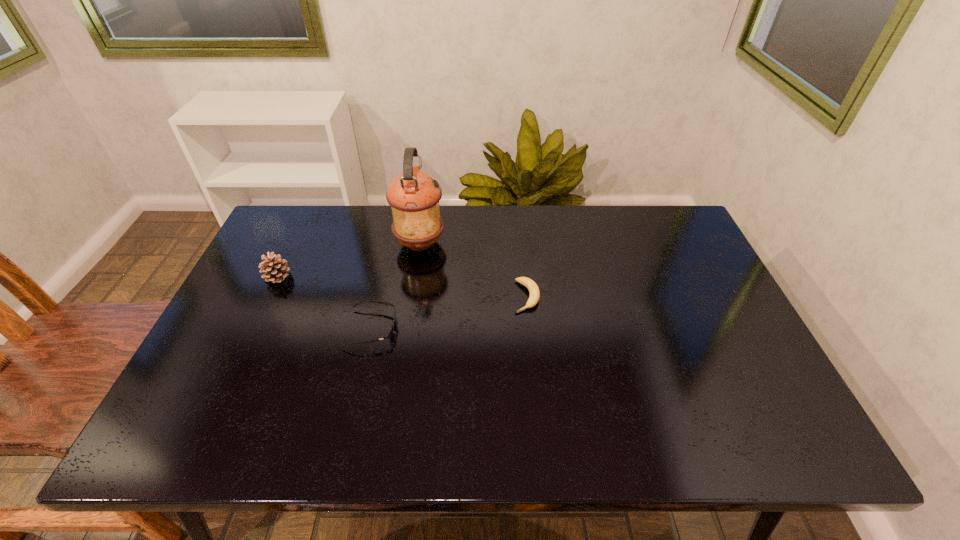
Find the location of `vacant area situated at the stem of the rightmost object`. vacant area situated at the stem of the rightmost object is located at coordinates (540, 430).

Identify the location of object present at the far edge. (413, 195).

Locate an element on the screen. This screenshot has width=960, height=540. object located at the left edge is located at coordinates (275, 268).

This screenshot has width=960, height=540. What are the coordinates of `free region at the far edge of the desktop` in the screenshot? It's located at (383, 225).

I want to click on free point at the near edge, so click(402, 435).

In the image, there is a desktop. Where is `vacant space at the left edge`? vacant space at the left edge is located at coordinates (240, 389).

In the image, there is a desktop. Where is `vacant space at the right edge`? Image resolution: width=960 pixels, height=540 pixels. vacant space at the right edge is located at coordinates (664, 276).

In the image, there is a desktop. Where is `vacant space at the far left corner`? The height and width of the screenshot is (540, 960). vacant space at the far left corner is located at coordinates (319, 236).

This screenshot has height=540, width=960. I want to click on blank space at the near left corner, so [206, 431].

At what (x,y) coordinates should I click in order to perform the action: click on free space at the far right corner. Please return your answer as a coordinate pair (x, y). The width and height of the screenshot is (960, 540). Looking at the image, I should click on coord(681,214).